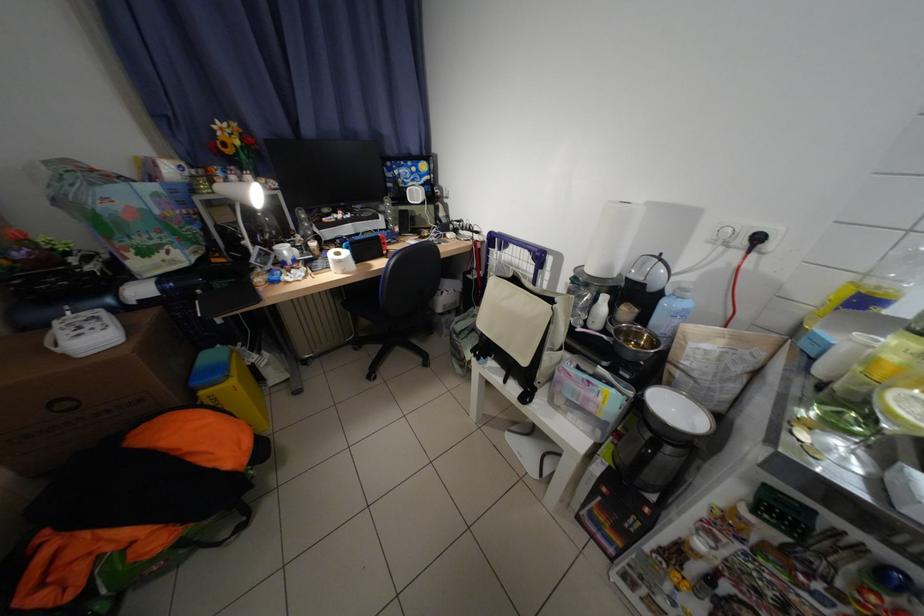
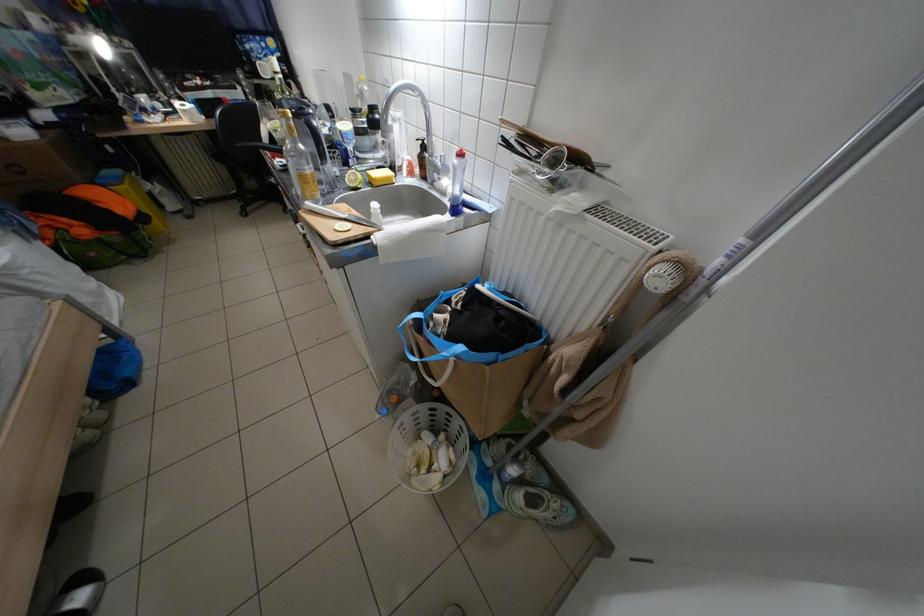
In the scene shown: In a continuous first-person perspective shot, in which direction is the camera moving?

The movement direction of the cameraman is right, backward.